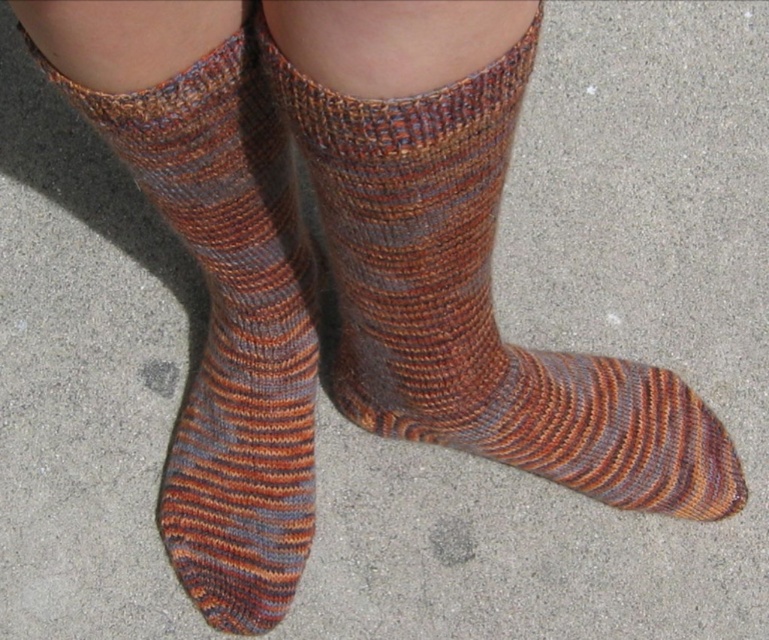
You are trying to decide which sock to wear for a hike. You have two options in the image, a striped wool sock at center and a multicolored knitted sock at center. Considering their heights, which sock would provide more ankle support?

The multicolored knitted sock at center is taller than the striped wool sock at center, so it would provide more ankle support.

You are standing on the concrete floor and see the striped wool sock at center. If you take a step forward, will your foot land closer to the sock or farther away from it?

The striped wool sock at center is located at point (x=475, y=298). Since you are standing on the concrete floor and take a step forward, your foot will move closer to the sock, so it will land closer to the striped wool sock at center.

You are trying to decide which sock to wear today. You have a striped wool sock at center and a multicolored knitted sock at center. Which one is larger?

The striped wool sock at center is bigger than the multicolored knitted sock at center.